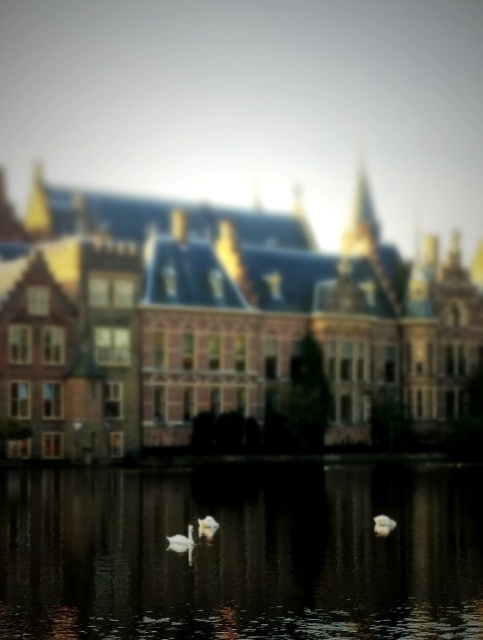
Between point (387, 528) and point (212, 524), which one is positioned behind?

The point (387, 528) is more distant.

Who is positioned more to the right, white fluffy swan at center or white matte swan at center?

white fluffy swan at center

Between point (381, 525) and point (212, 522), which one is positioned in front?

Point (212, 522)

Locate an element on the screen. white fluffy swan at center is located at coordinates (383, 524).

This screenshot has height=640, width=483. What are the coordinates of `smooth reflective water at center` in the screenshot? It's located at (241, 552).

From the picture: Measure the distance between smooth reflective water at center and white feathered swan at center.

smooth reflective water at center and white feathered swan at center are 10.04 meters apart.

You are a GUI agent. You are given a task and a screenshot of the screen. Output one action in this format:
    pyautogui.click(x=<x>, y=<y>)
    Task: Click on the smooth reflective water at center
    The height and width of the screenshot is (640, 483).
    Given the screenshot: What is the action you would take?
    pyautogui.click(x=241, y=552)

Can you confirm if brown brick palace at center is positioned below white matte swan at center?

No, brown brick palace at center is not below white matte swan at center.

Does brown brick palace at center have a lesser height compared to white matte swan at center?

No, brown brick palace at center is not shorter than white matte swan at center.

Does point (275, 304) come in front of point (212, 525)?

No, (275, 304) is further to viewer.

You are a GUI agent. You are given a task and a screenshot of the screen. Output one action in this format:
    pyautogui.click(x=<x>, y=<y>)
    Task: Click on the brown brick palace at center
    This screenshot has height=640, width=483.
    Given the screenshot: What is the action you would take?
    pyautogui.click(x=213, y=320)